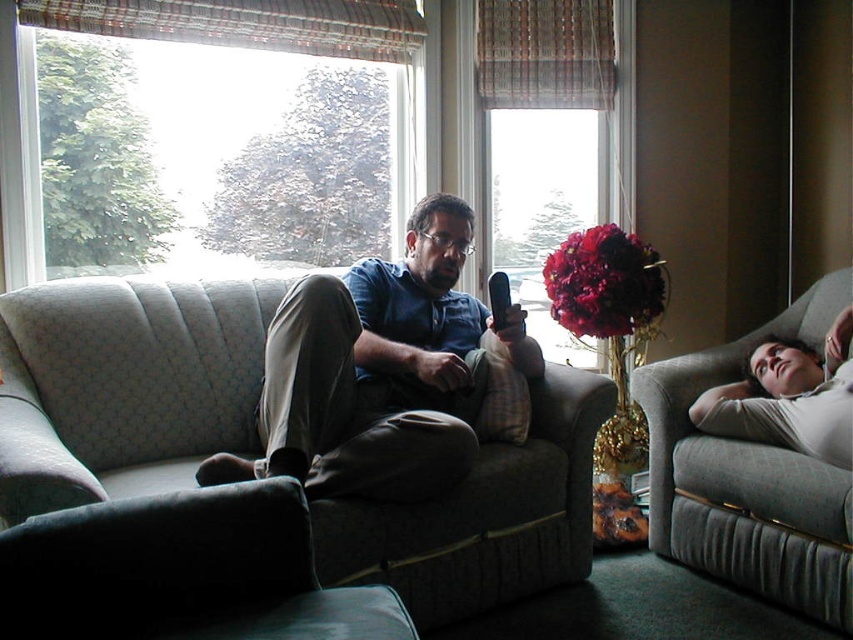
Question: Estimate the real-world distances between objects in this image. Which object is farther from the velvety red bouquet at center?

Choices:
 (A) matte glass window at center
 (B) dark gray fabric ottoman at lower left

Answer: (B)

Question: Which point is farther to the camera?

Choices:
 (A) velvety red bouquet at center
 (B) gray fabric couch at right
 (C) matte glass window at center
 (D) textured fabric couch at center

Answer: (C)

Question: Which of the following is the farthest from the observer?

Choices:
 (A) velvety red bouquet at center
 (B) dark gray fabric ottoman at lower left
 (C) gray fabric couch at right

Answer: (A)

Question: Does matte blue shirt at center appear under gray fabric couch at right?

Choices:
 (A) no
 (B) yes

Answer: (A)

Question: Does dark gray fabric ottoman at lower left appear over clear glass window at upper left?

Choices:
 (A) yes
 (B) no

Answer: (B)

Question: Considering the relative positions of textured fabric couch at center and clear glass window at upper left in the image provided, where is textured fabric couch at center located with respect to clear glass window at upper left?

Choices:
 (A) right
 (B) left

Answer: (B)